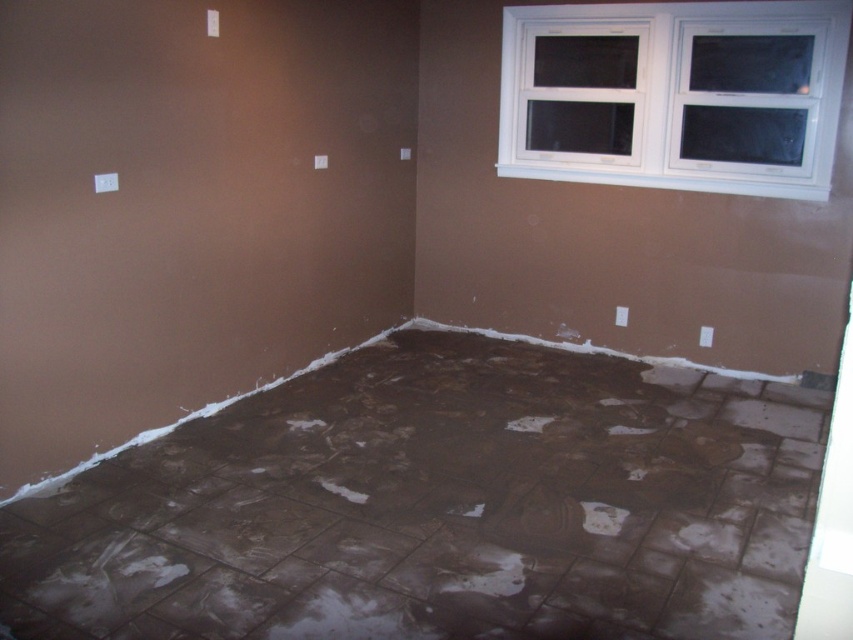
Can you confirm if brown matte tile floor at center is wider than white plastic window at upper right?

Yes, brown matte tile floor at center is wider than white plastic window at upper right.

Is brown matte tile floor at center positioned in front of white plastic window at upper right?

Yes, brown matte tile floor at center is closer to the viewer.

The height and width of the screenshot is (640, 853). What do you see at coordinates (437, 506) in the screenshot? I see `brown matte tile floor at center` at bounding box center [437, 506].

Where is `brown matte tile floor at center`? brown matte tile floor at center is located at coordinates (437, 506).